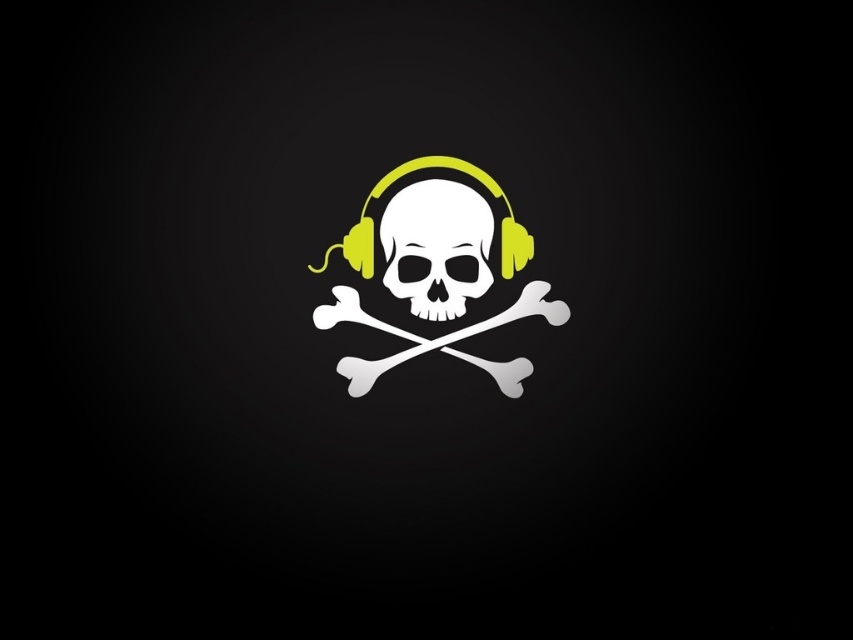
Question: Does white matte skull and crossbones at center have a greater width compared to white matte skull at center?

Choices:
 (A) yes
 (B) no

Answer: (A)

Question: Among these points, which one is farthest from the camera?

Choices:
 (A) (428, 273)
 (B) (440, 340)

Answer: (A)

Question: Is white matte skull and crossbones at center wider than white matte skull at center?

Choices:
 (A) yes
 (B) no

Answer: (A)

Question: Is white matte skull and crossbones at center further to camera compared to white matte skull at center?

Choices:
 (A) no
 (B) yes

Answer: (A)